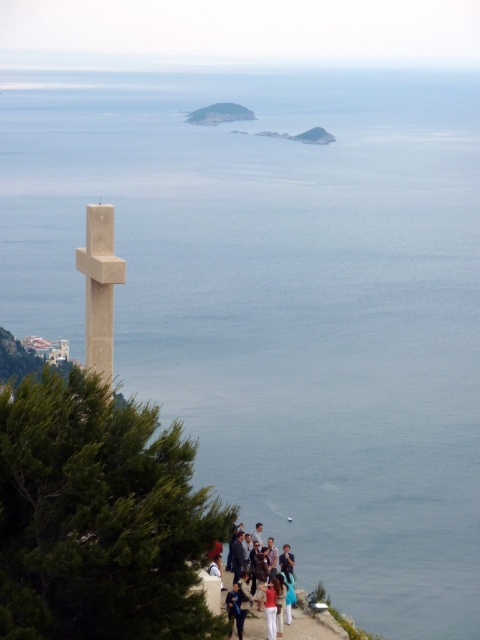
Looking at this image, you are standing at the edge of the cliff and want to walk towards the stone cross on the left. Which direction should you move relative to the matte concrete path at lower center?

To reach the stone cross on the left, you should move towards the left side of the matte concrete path at lower center since the cross is positioned on the left side of the frame.

You are a photographer trying to capture the smooth concrete cross at center and the matte concrete path at lower center in the same frame. Which object will appear larger in your photo?

The smooth concrete cross at center will appear larger in the photo because it is taller than the matte concrete path at lower center.